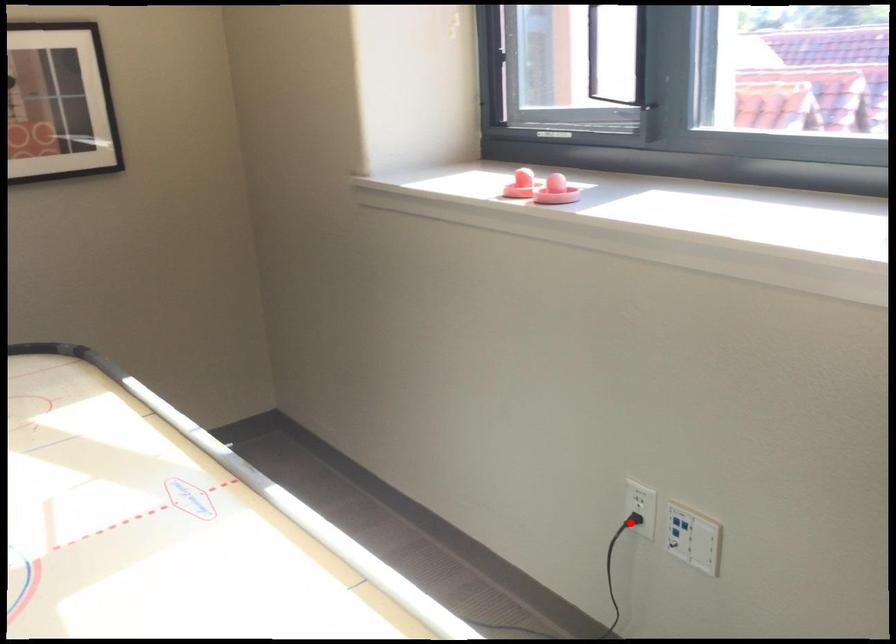
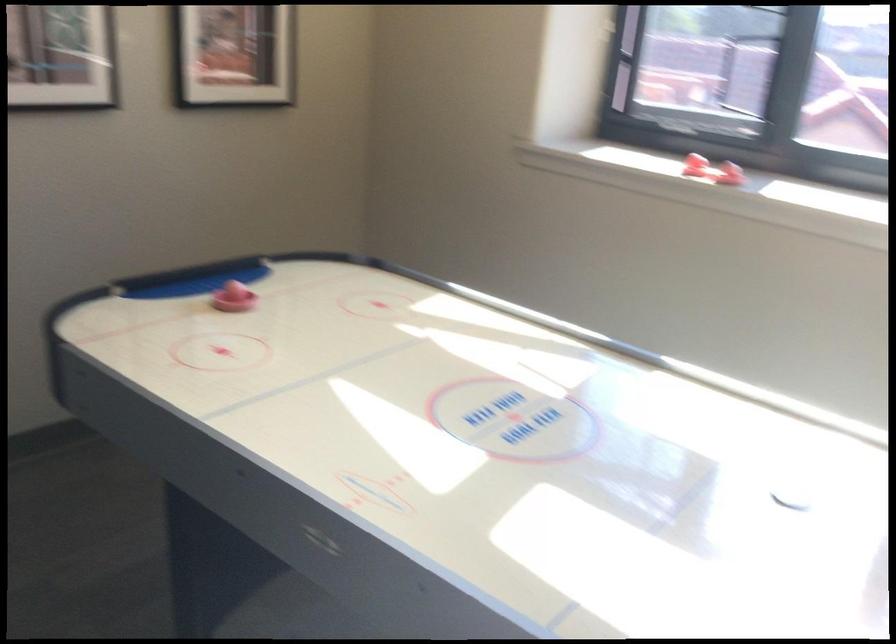
Question: I am providing you with two images of the same scene from different viewpoints. A red point is marked on the first image. Is the red point's position out of view in image 2?

Choices:
 (A) Yes
 (B) No

Answer: (A)